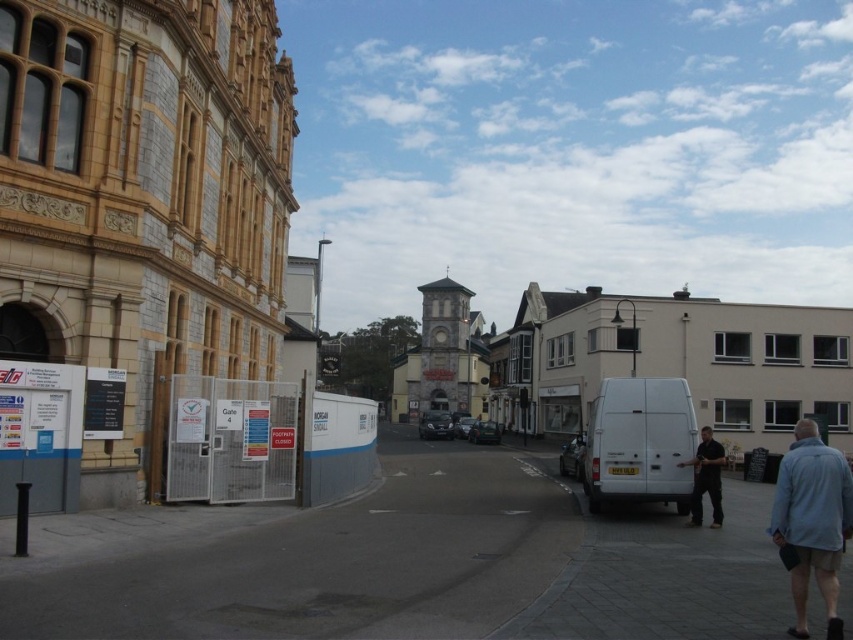
You are a pedestrian trying to cross the street at the construction site. There is a white matte van at center and a blue denim jacket at lower right. Which object is closer to the construction site fence?

The white matte van at center is positioned over the blue denim jacket at lower right, meaning it is closer to the construction site fence.

You are standing at point A located at coordinates (x=639, y=442). What object is exactly at your current location?

The white matte van at center is exactly at point A located at coordinates (x=639, y=442).